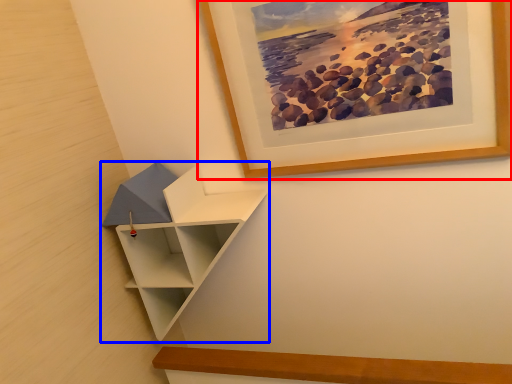
Question: Which point is closer to the camera, picture frame (highlighted by a red box) or shelf (highlighted by a blue box)?

Choices:
 (A) picture frame
 (B) shelf

Answer: (A)